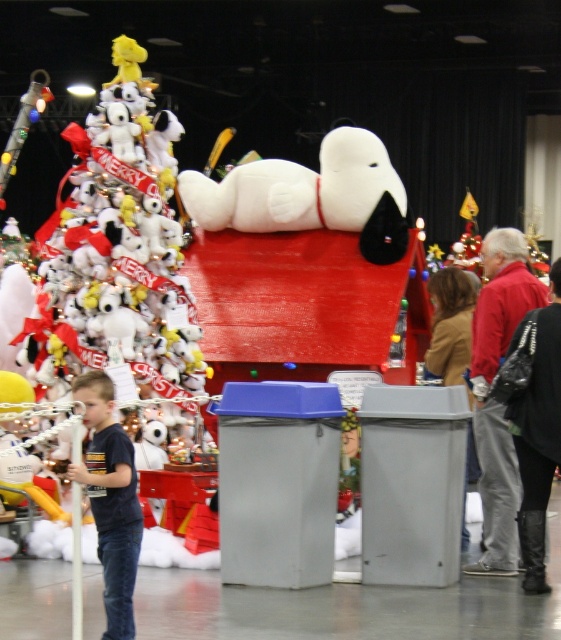
Question: Which is farther from the brown leather jacket at center?

Choices:
 (A) dark blue t-shirt at lower left
 (B) white plush dog at center

Answer: (A)

Question: Does white plush snoopy at upper center have a larger size compared to black leather boots at lower right?

Choices:
 (A) no
 (B) yes

Answer: (B)

Question: Where is white plush snoopy at upper center located in relation to dark blue t-shirt at lower left in the image?

Choices:
 (A) right
 (B) left

Answer: (B)

Question: Does white plush snoopy at upper center have a smaller size compared to brown leather jacket at center?

Choices:
 (A) yes
 (B) no

Answer: (B)

Question: Which point is closer to the camera?

Choices:
 (A) (108, 561)
 (B) (558, 328)

Answer: (A)

Question: Which point is farther to the camera?

Choices:
 (A) white plush dog at center
 (B) white plush snoopy at upper center

Answer: (A)